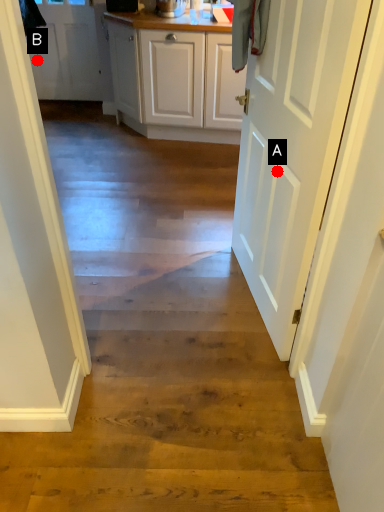
Question: Two points are circled on the image, labeled by A and B beside each circle. Which point is farther to the camera?

Choices:
 (A) A is further
 (B) B is further

Answer: (B)